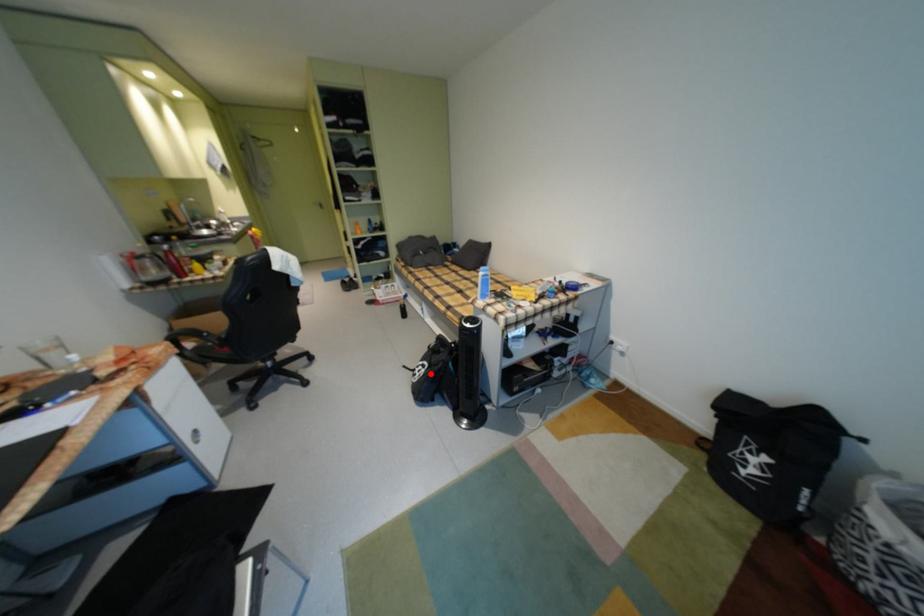
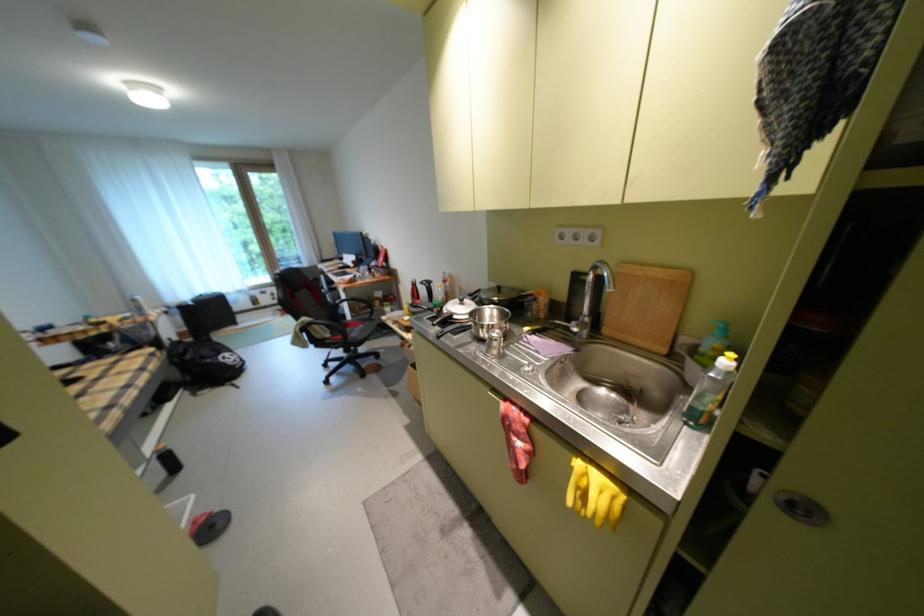
Question: I am providing you with two images of the same scene from different viewpoints. Given a red point in image1, look at the same physical point in image2. Is it:

Choices:
 (A) Closer to the viewpoint
 (B) Farther from the viewpoint

Answer: (A)